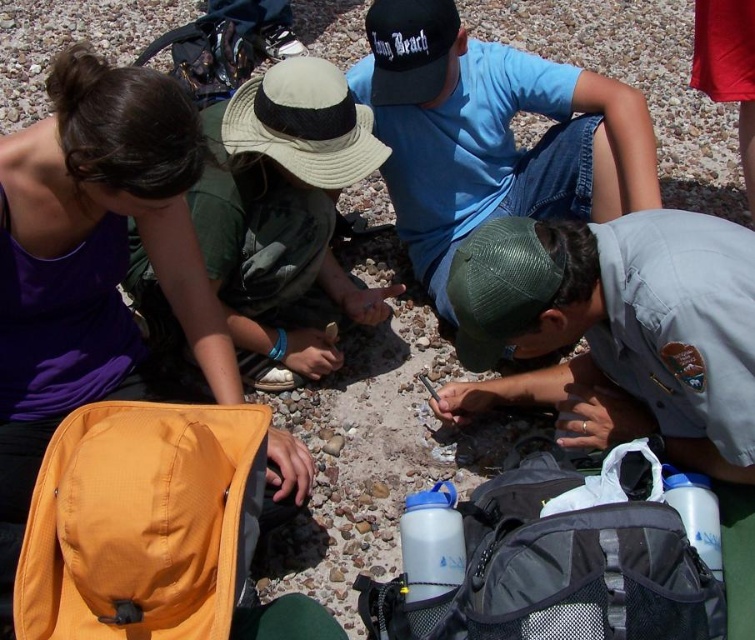
Can you confirm if blue cotton shirt at upper center is taller than tan fabric baseball hat at center?

Yes.

Can you confirm if blue cotton shirt at upper center is wider than tan fabric baseball hat at center?

Yes, blue cotton shirt at upper center is wider than tan fabric baseball hat at center.

Which is behind, point (621, 115) or point (334, 97)?

The point (621, 115) is more distant.

This screenshot has width=755, height=640. Find the location of `blue cotton shirt at upper center`. blue cotton shirt at upper center is located at coordinates 492,134.

How far apart are blue cotton shirt at upper center and black fabric baseball cap at upper center?

A distance of 7.07 inches exists between blue cotton shirt at upper center and black fabric baseball cap at upper center.

Which of these two, blue cotton shirt at upper center or black fabric baseball cap at upper center, stands taller?

blue cotton shirt at upper center

Is point (347, 72) behind point (418, 100)?

Yes, point (347, 72) is behind point (418, 100).

Identify the location of blue cotton shirt at upper center. Image resolution: width=755 pixels, height=640 pixels. coord(492,134).

In the scene shown: Is green fabric hat at upper center above green mesh baseball cap at center?

Yes.

Between green fabric hat at upper center and green mesh baseball cap at center, which one appears on the left side from the viewer's perspective?

From the viewer's perspective, green fabric hat at upper center appears more on the left side.

Identify the location of green fabric hat at upper center. (284, 218).

Where is `green fabric hat at upper center`? green fabric hat at upper center is located at coordinates (284, 218).